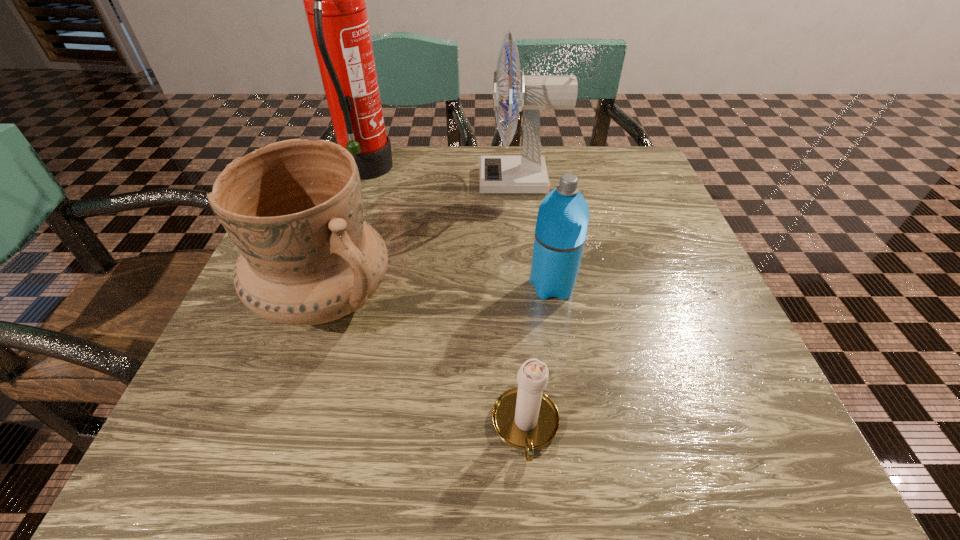
What are the coordinates of `vacant area at the left edge` in the screenshot? It's located at (301, 355).

In the image, there is a desktop. Where is `free space at the right edge`? The width and height of the screenshot is (960, 540). free space at the right edge is located at coordinates (689, 351).

I want to click on vacant region at the near left corner, so click(195, 410).

In the image, there is a desktop. At what (x,y) coordinates should I click in order to perform the action: click on free space at the far right corner. Please return your answer as a coordinate pair (x, y). This screenshot has width=960, height=540. Looking at the image, I should click on (593, 146).

Locate an element on the screen. The height and width of the screenshot is (540, 960). vacant space at the near right corner of the desktop is located at coordinates point(765,454).

Locate an element on the screen. This screenshot has height=540, width=960. vacant space in between the candle holder and the fan is located at coordinates (523, 304).

The height and width of the screenshot is (540, 960). Find the location of `empty space between the thermos bottle and the nearest object`. empty space between the thermos bottle and the nearest object is located at coordinates (539, 356).

This screenshot has width=960, height=540. Find the location of `free space between the pottery and the fan`. free space between the pottery and the fan is located at coordinates (422, 239).

Identify the location of free space between the pottery and the thermos bottle. (439, 292).

Locate an element on the screen. This screenshot has height=540, width=960. vacant point located between the candle holder and the pottery is located at coordinates (425, 362).